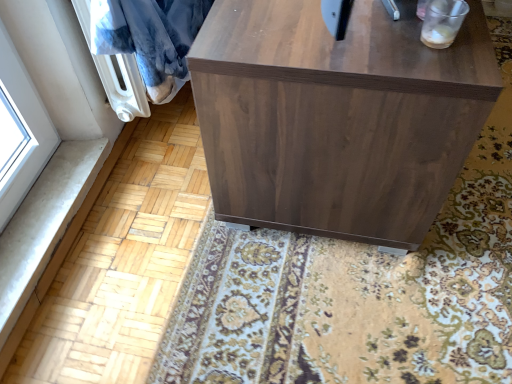
Question: Considering the positions of walnut wood cabinet at center and blue plush blanket at upper left in the image, is walnut wood cabinet at center taller or shorter than blue plush blanket at upper left?

Choices:
 (A) short
 (B) tall

Answer: (B)

Question: From a real-world perspective, is walnut wood cabinet at center physically located above or below blue plush blanket at upper left?

Choices:
 (A) above
 (B) below

Answer: (B)

Question: From the image's perspective, is walnut wood cabinet at center located above or below blue plush blanket at upper left?

Choices:
 (A) above
 (B) below

Answer: (A)

Question: From the image's perspective, is blue plush blanket at upper left located above or below walnut wood cabinet at center?

Choices:
 (A) below
 (B) above

Answer: (A)

Question: Is blue plush blanket at upper left taller or shorter than walnut wood cabinet at center?

Choices:
 (A) short
 (B) tall

Answer: (A)

Question: Based on their positions, is blue plush blanket at upper left located to the left or right of walnut wood cabinet at center?

Choices:
 (A) right
 (B) left

Answer: (B)

Question: In the image, is blue plush blanket at upper left positioned in front of or behind walnut wood cabinet at center?

Choices:
 (A) front
 (B) behind

Answer: (B)